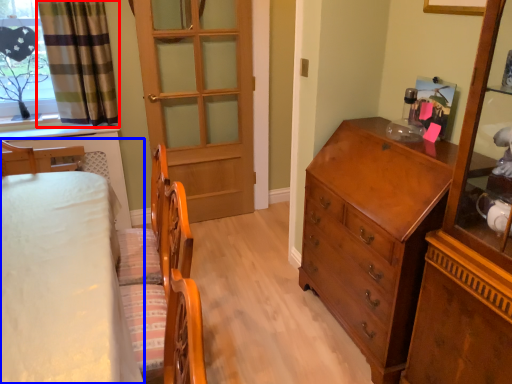
Question: Which object is closer to the camera taking this photo, curtain (highlighted by a red box) or bed (highlighted by a blue box)?

Choices:
 (A) curtain
 (B) bed

Answer: (B)